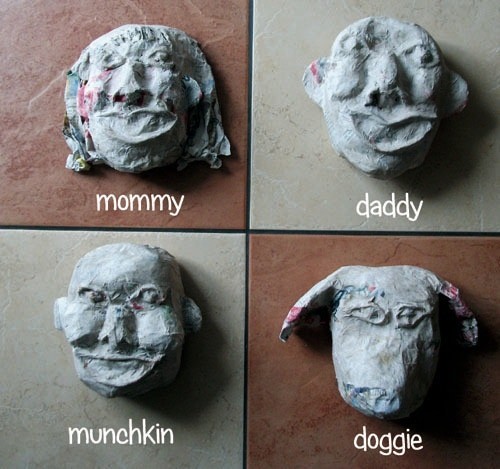
Find the location of `gray tile`. gray tile is located at coordinates (216, 261), (287, 202).